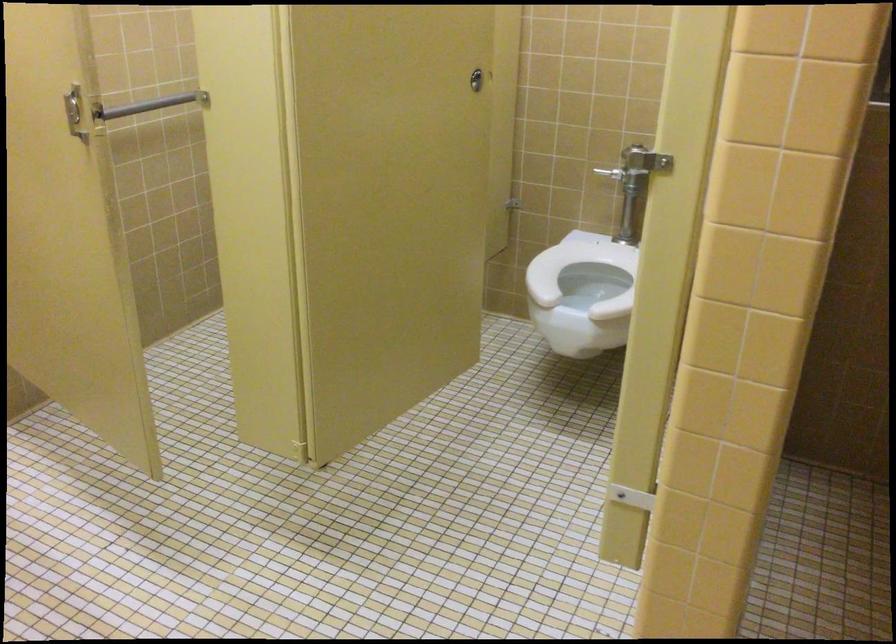
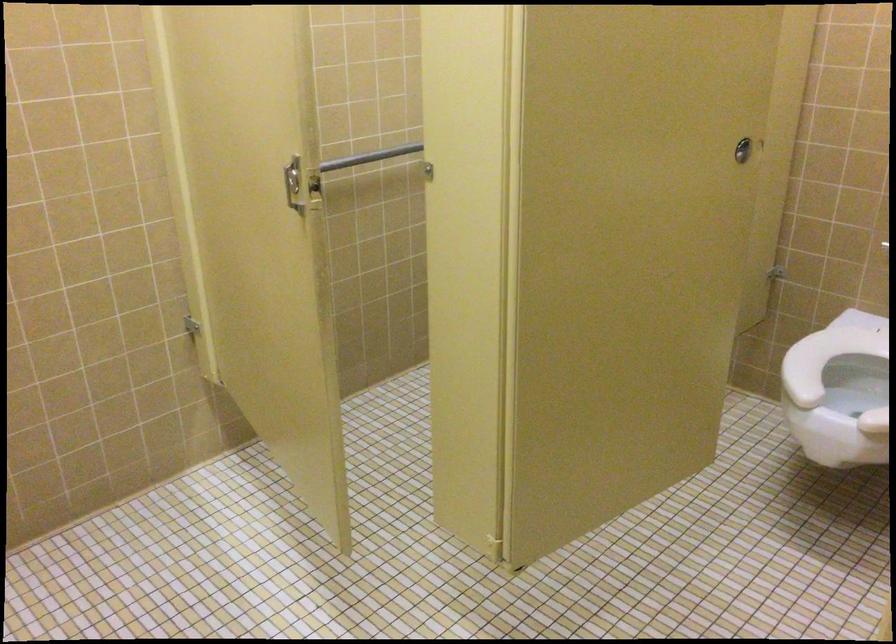
Where in the second image is the point corresponding to pixel 125 118 from the first image?

(369, 156)